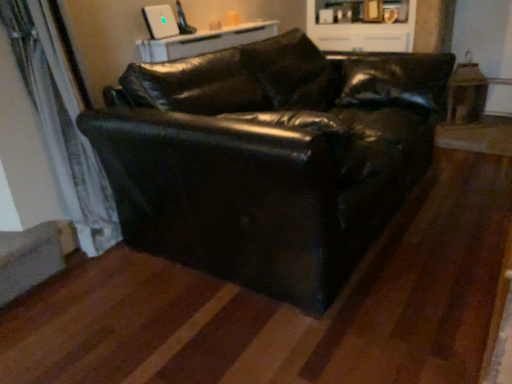
Image resolution: width=512 pixels, height=384 pixels. Find the location of `space that is in front of white sheer curtain at left`. space that is in front of white sheer curtain at left is located at coordinates (65, 306).